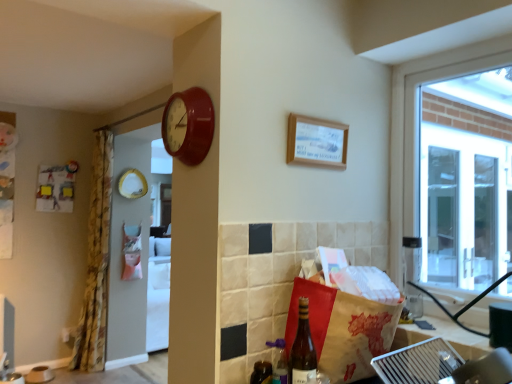
Question: Is translucent glass bottle at lower center, the second bottle viewed from the back, completely or partially inside matte red clock at upper center?

Choices:
 (A) no
 (B) yes

Answer: (A)

Question: From the image's perspective, does matte red clock at upper center appear higher than translucent glass bottle at lower center, the second bottle viewed from the back?

Choices:
 (A) no
 (B) yes

Answer: (B)

Question: Could you tell me if matte red clock at upper center is turned towards translucent glass bottle at lower center, the second bottle viewed from the back?

Choices:
 (A) yes
 (B) no

Answer: (B)

Question: Is matte red clock at upper center further to the viewer compared to translucent glass bottle at lower center, acting as the first bottle starting from the front?

Choices:
 (A) no
 (B) yes

Answer: (B)

Question: Is matte red clock at upper center next to translucent glass bottle at lower center, acting as the first bottle starting from the front?

Choices:
 (A) no
 (B) yes

Answer: (A)

Question: Is matte red clock at upper center closer to camera compared to translucent glass bottle at lower center, acting as the first bottle starting from the front?

Choices:
 (A) yes
 (B) no

Answer: (B)

Question: From the image's perspective, would you say shiny dark brown bottle at lower center, marked as the 1th bottle in a back-to-front arrangement, is shown under matte red clock at upper center?

Choices:
 (A) yes
 (B) no

Answer: (A)

Question: Is shiny dark brown bottle at lower center, the second bottle viewed from the front, positioned in front of matte red clock at upper center?

Choices:
 (A) no
 (B) yes

Answer: (A)

Question: Is shiny dark brown bottle at lower center, the second bottle viewed from the front, to the right of matte red clock at upper center from the viewer's perspective?

Choices:
 (A) no
 (B) yes

Answer: (B)

Question: Does shiny dark brown bottle at lower center, the second bottle viewed from the front, have a larger size compared to matte red clock at upper center?

Choices:
 (A) yes
 (B) no

Answer: (B)

Question: Is shiny dark brown bottle at lower center, marked as the 1th bottle in a back-to-front arrangement, facing towards matte red clock at upper center?

Choices:
 (A) yes
 (B) no

Answer: (B)

Question: From the image's perspective, does shiny dark brown bottle at lower center, the second bottle viewed from the front, appear higher than matte red clock at upper center?

Choices:
 (A) yes
 (B) no

Answer: (B)

Question: Is floral fabric curtain at left in front of shiny dark brown bottle at lower center, marked as the 1th bottle in a back-to-front arrangement?

Choices:
 (A) no
 (B) yes

Answer: (A)